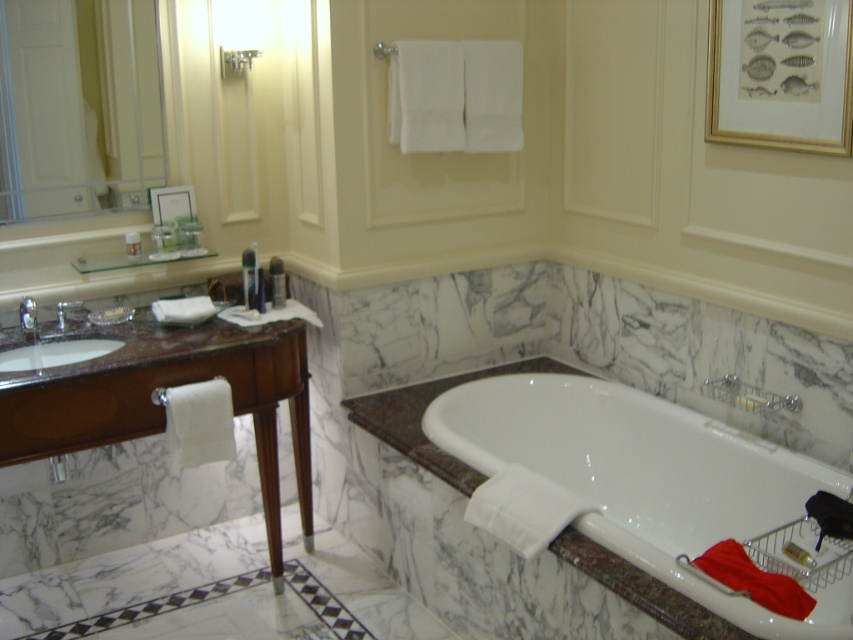
Question: Where is brown polished wood vanity at left located in relation to white glossy sink at left in the image?

Choices:
 (A) above
 (B) below

Answer: (B)

Question: Estimate the real-world distances between objects in this image. Which object is farther from the brushed metal faucet at left?

Choices:
 (A) white marble shower at upper center
 (B) white fabric towel bar at left
 (C) white glossy bathtub at center

Answer: (C)

Question: Where is white fabric towel bar at left located in relation to white marble shower at upper center in the image?

Choices:
 (A) right
 (B) left

Answer: (A)

Question: Based on their relative distances, which object is nearer to the gold framed picture of fish at upper right?

Choices:
 (A) white glossy bathtub at center
 (B) white glossy sink at left

Answer: (A)

Question: Can you confirm if matte white picture frame at upper left is positioned to the right of brushed metal faucet at left?

Choices:
 (A) yes
 (B) no

Answer: (A)

Question: Which object is the farthest from the brown polished wood vanity at left?

Choices:
 (A) white glossy sink at left
 (B) white fabric towel bar at left

Answer: (A)